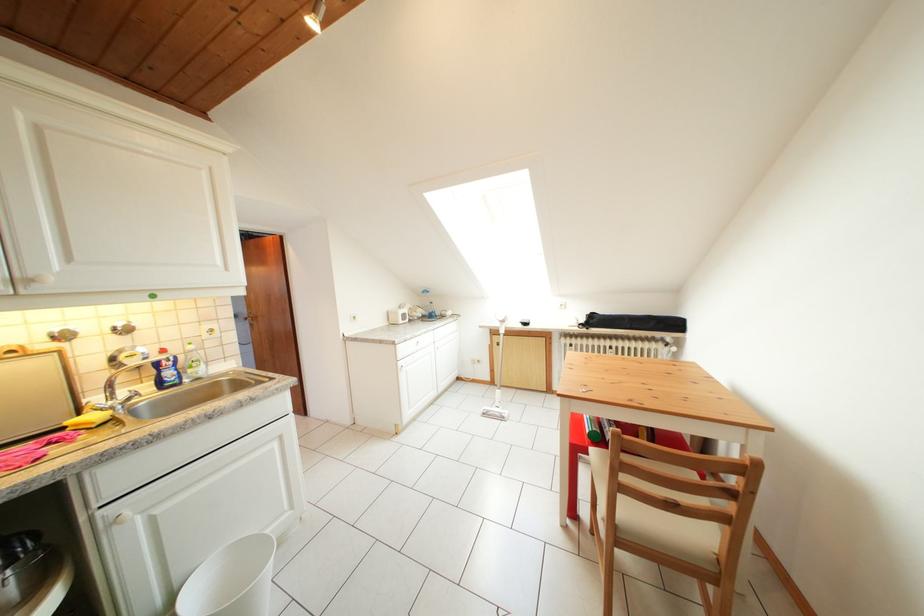
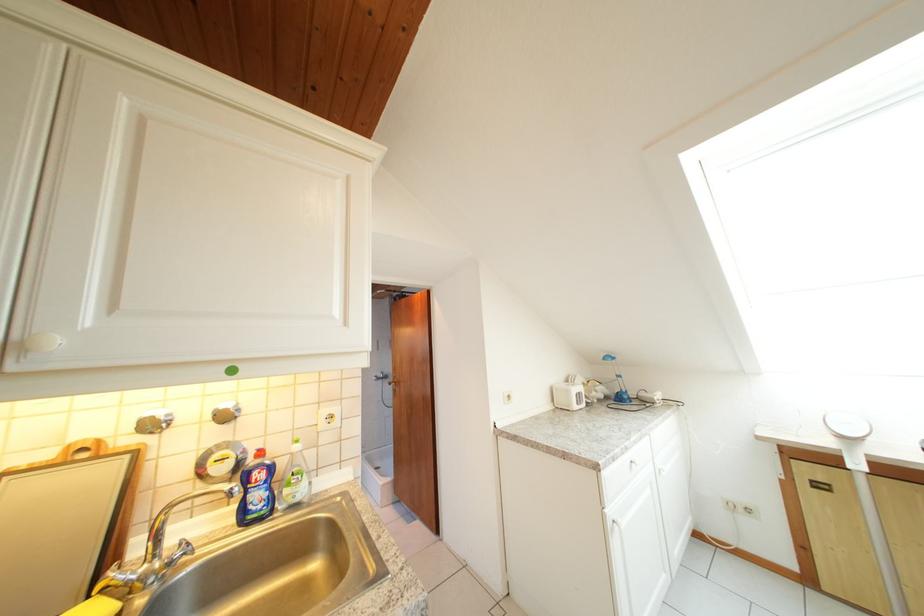
Where in the second image is the point corresponding to (x=261, y=330) from the first image?

(403, 395)